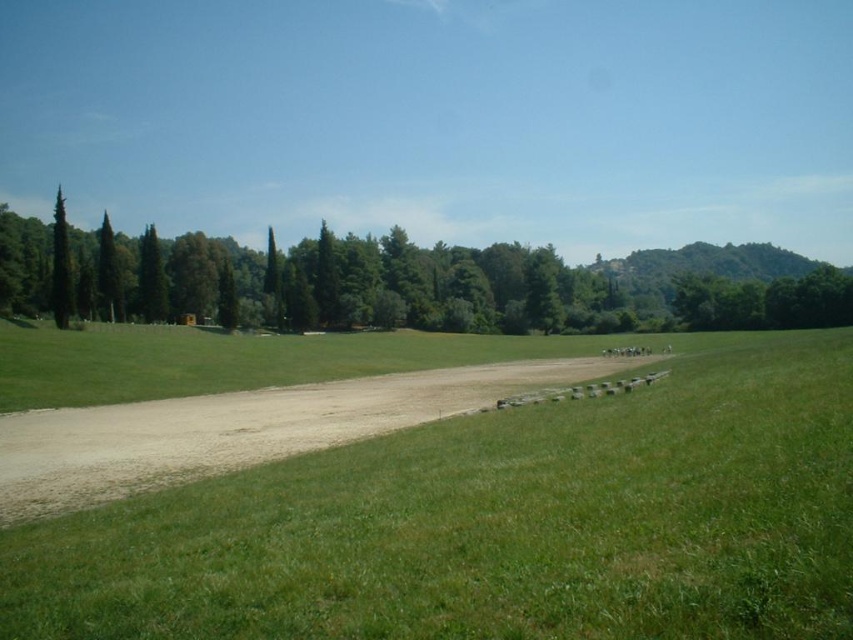
Question: Which point appears closest to the camera in this image?

Choices:
 (A) (167, 316)
 (B) (189, 458)

Answer: (B)

Question: Among these objects, which one is nearest to the camera?

Choices:
 (A) brown gravel dirt track at center
 (B) green grassy field at center

Answer: (B)

Question: Does green grassy field at center appear on the right side of brown gravel dirt track at center?

Choices:
 (A) no
 (B) yes

Answer: (B)

Question: Is green leafy tree at left to the right of brown gravel dirt track at center from the viewer's perspective?

Choices:
 (A) yes
 (B) no

Answer: (A)

Question: Among these objects, which one is farthest from the camera?

Choices:
 (A) green grassy field at center
 (B) green leafy tree at left
 (C) green matte tree at left
 (D) brown gravel dirt track at center

Answer: (B)

Question: Is brown gravel dirt track at center above green matte tree at left?

Choices:
 (A) yes
 (B) no

Answer: (B)